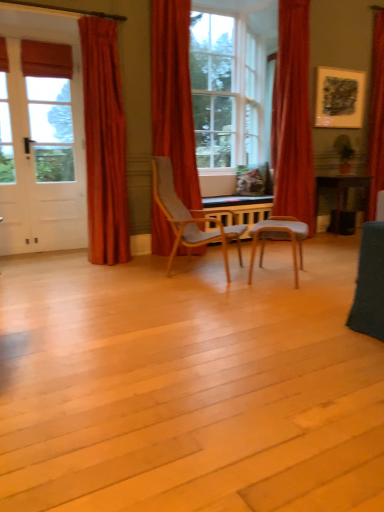
Locate an element on the screen. The width and height of the screenshot is (384, 512). unoccupied area in front of wooden chair at center, which is the first chair from right to left is located at coordinates (290, 296).